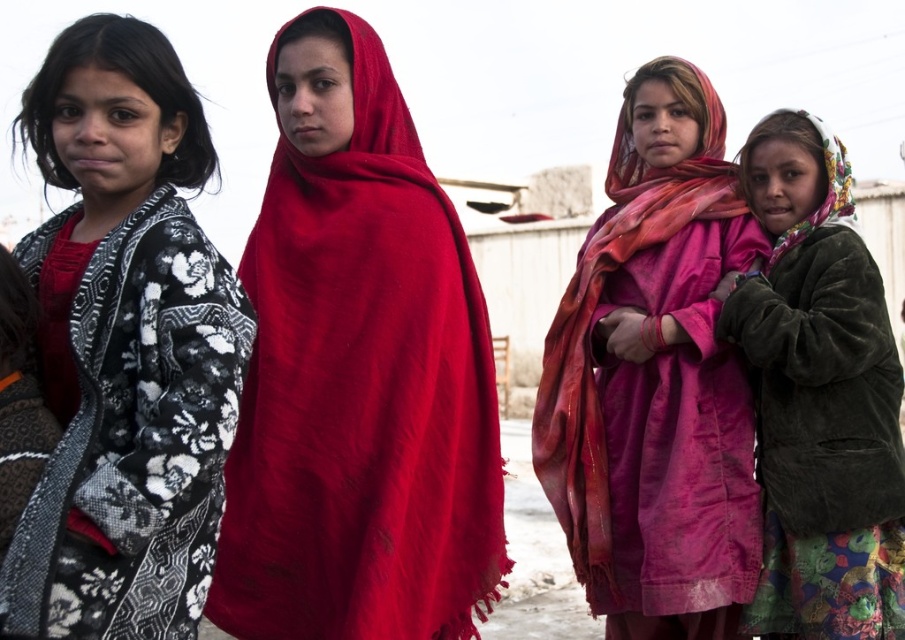
Question: Estimate the real-world distances between objects in this image. Which object is closer to the pink fabric scarf at center?

Choices:
 (A) matte red shawl at center
 (B) black and white floral shawl at left

Answer: (A)

Question: Among these points, which one is nearest to the camera?

Choices:
 (A) (56, 289)
 (B) (732, 291)
 (C) (684, 499)
 (D) (359, 602)

Answer: (A)

Question: Is black and white floral shawl at left in front of pink fabric scarf at center?

Choices:
 (A) yes
 (B) no

Answer: (A)

Question: Which point is farther to the camera?

Choices:
 (A) (808, 362)
 (B) (69, 278)
 (C) (412, 257)
 (D) (614, 440)

Answer: (D)

Question: Can you confirm if matte red shawl at center is positioned below black and white floral shawl at left?

Choices:
 (A) yes
 (B) no

Answer: (B)

Question: Can you confirm if pink fabric scarf at center is wider than velvet brown jacket at lower right?

Choices:
 (A) yes
 (B) no

Answer: (A)